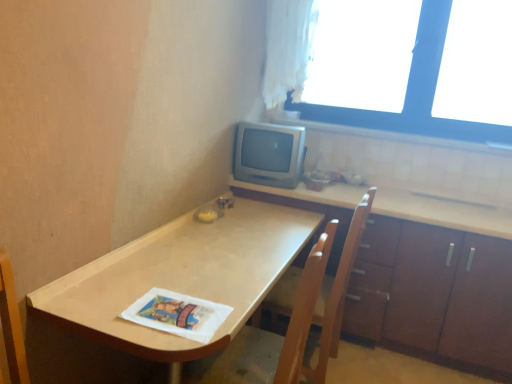
Find the location of a particular element. vacant point to the left of white paper magazine at lower center is located at coordinates (102, 308).